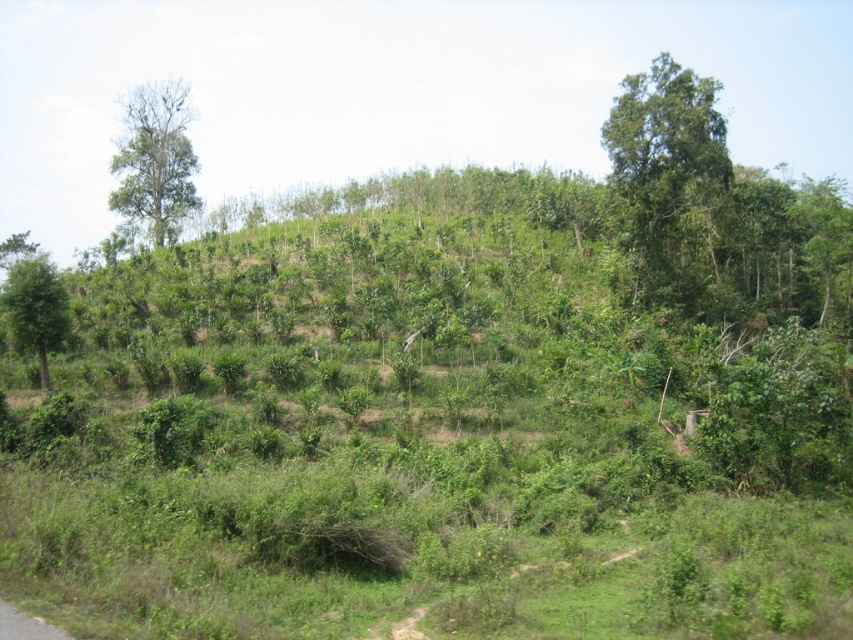
You are standing at the base of the hillside and want to walk towards the green leafy tree at upper right. Which direction should you head relative to the green leafy tree at left?

You should head to the right relative to the green leafy tree at left because the green leafy tree at upper right is positioned to the right of it.

You are a hiker planning to cross the hillside. You notice the bare wood tree at upper left and the green leafy tree at left. Which tree would you choose to rest under for shade, and why?

You should choose the green leafy tree at left because it provides more shade than the bare wood tree at upper left, which is smaller and lacks leaves.

You are a hiker standing at the bottom of the hillside. You see the green leafy tree at upper right and the bare wood tree at upper left. Which tree is positioned more to the east if the image is oriented with north at the top?

The green leafy tree at upper right is positioned more to the east because in the image oriented with north at the top, east is to the right side. Since the green leafy tree at upper right is to the right of the bare wood tree at upper left, it is further east.